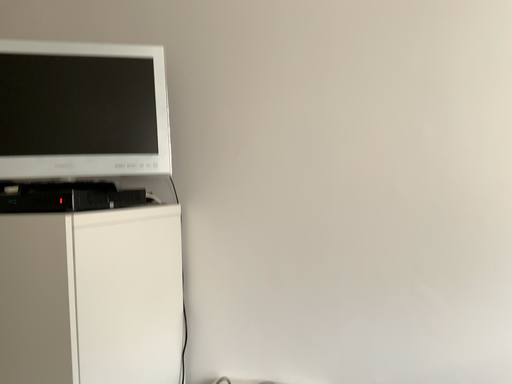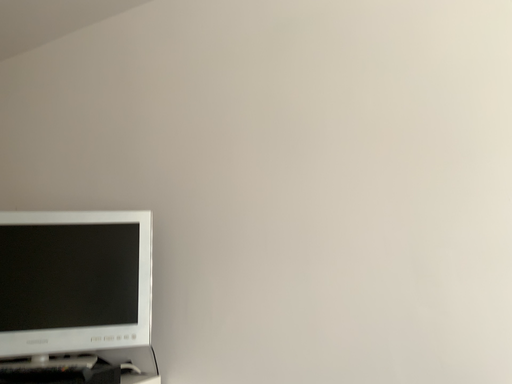
Question: How did the camera likely rotate when shooting the video?

Choices:
 (A) rotated upward
 (B) rotated downward

Answer: (A)